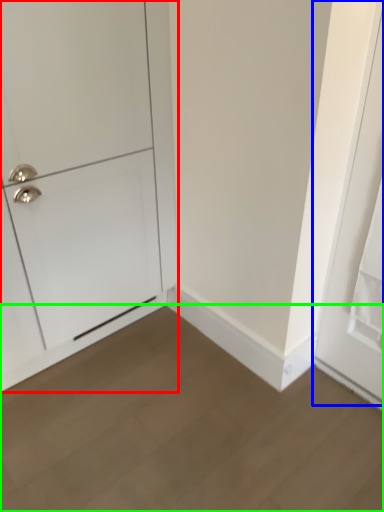
Question: Which object is positioned farthest from door (highlighted by a red box)? Select from door (highlighted by a blue box) and plain (highlighted by a green box).

Choices:
 (A) door
 (B) plain

Answer: (A)